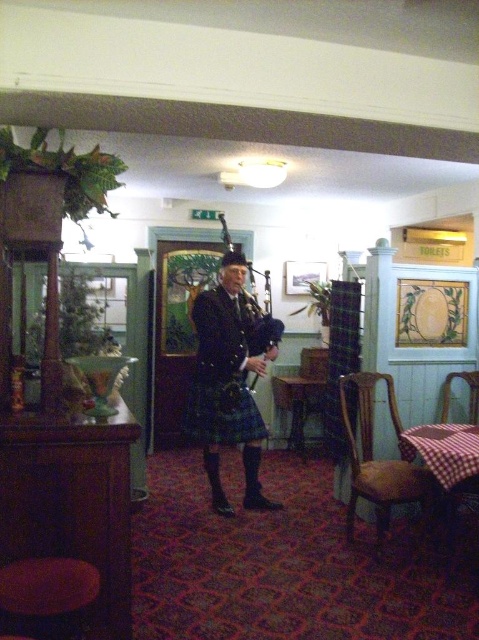
You are standing at the entrance of the pub and need to sit down. Where is the dark brown wooden stool at lower left located in relation to the entrance?

The dark brown wooden stool at lower left is located at point (48, 595), which is near the lower left corner of the entrance area. Since you are facing the entrance, the stool would be to your left side, slightly forward in position.

You are standing at the entrance of the pub and want to locate the person wearing the matte black kilt at center. According to the coordinates provided, where should you look relative to the center of the image?

The matte black kilt at center is located at coordinates point 0.594 on the x axis and 0.480 on the y axis, which means it is slightly to the right and just below the center of the image.

You are a guest in this pub and want to sit down on the checkered fabric chair at lower right. The server tells you that you must be at least 1.5 meters away from the matte black kilt at center to avoid disturbing the bagpiper. Can you sit there?

The matte black kilt at center is 1.63 meters from the checkered fabric chair at lower right. Since 1.63 meters is more than the required 1.5 meters distance, you can sit there without disturbing the bagpiper.